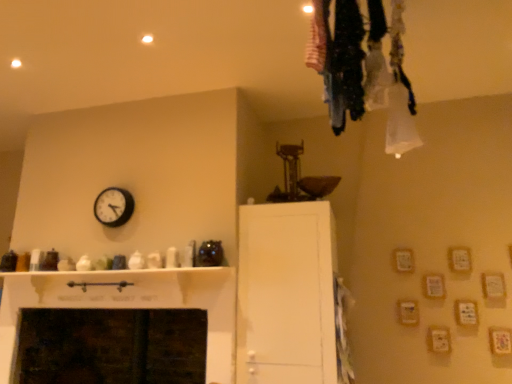
Question: Considering the positions of point (117, 223) and point (321, 347), is point (117, 223) closer or farther from the camera than point (321, 347)?

Choices:
 (A) closer
 (B) farther

Answer: (B)

Question: Is white plastic clock at upper left wider or thinner than white matte cabinet at center?

Choices:
 (A) thin
 (B) wide

Answer: (A)

Question: Considering their positions, is white plastic clock at upper left located in front of or behind white matte cabinet at center?

Choices:
 (A) behind
 (B) front

Answer: (A)

Question: From the image's perspective, relative to white plastic clock at upper left, is white matte cabinet at center above or below?

Choices:
 (A) above
 (B) below

Answer: (B)

Question: Based on their positions, is white matte cabinet at center located to the left or right of white plastic clock at upper left?

Choices:
 (A) right
 (B) left

Answer: (A)

Question: Choose the correct answer: Is white matte cabinet at center inside white plastic clock at upper left or outside it?

Choices:
 (A) inside
 (B) outside

Answer: (B)

Question: Is white matte cabinet at center bigger or smaller than white plastic clock at upper left?

Choices:
 (A) big
 (B) small

Answer: (A)